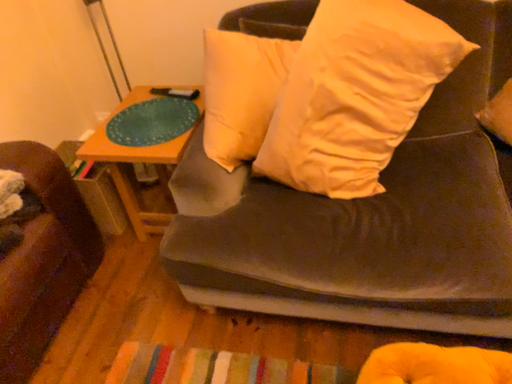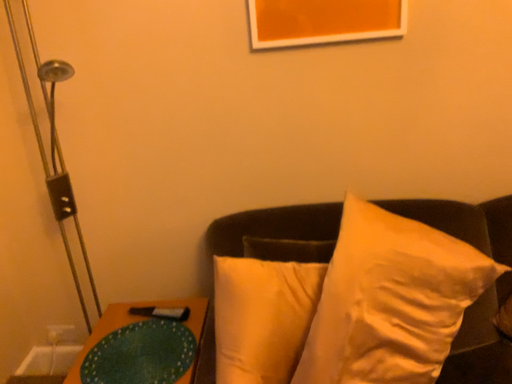
Question: Which way did the camera rotate in the video?

Choices:
 (A) rotated downward
 (B) rotated upward

Answer: (B)